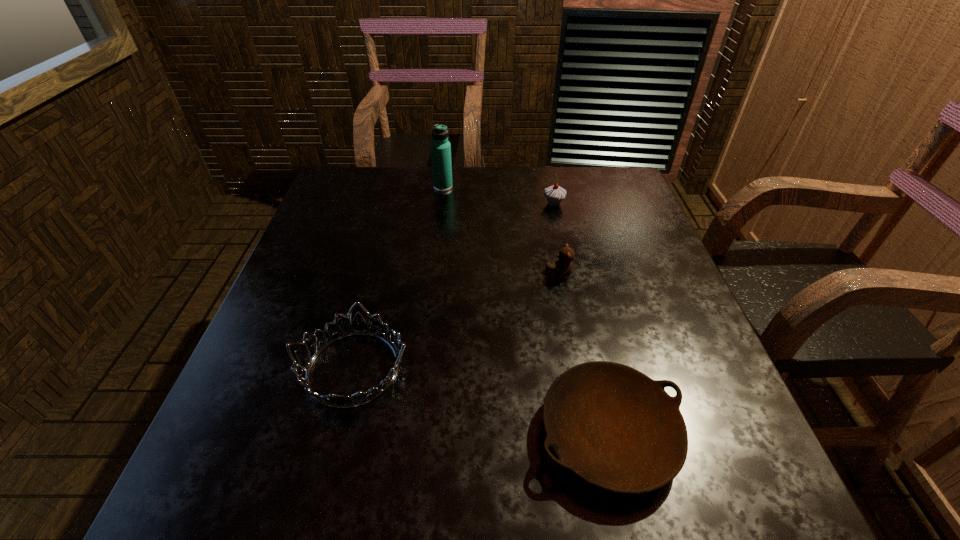
In order to click on free region located 0.340m on the face of the teddy bear in this screenshot , I will do `click(401, 275)`.

At what (x,y) coordinates should I click in order to perform the action: click on vacant space located on the face of the teddy bear. Please return your answer as a coordinate pair (x, y). The width and height of the screenshot is (960, 540). Looking at the image, I should click on (499, 275).

This screenshot has width=960, height=540. In order to click on free space located on the front-facing side of the tiara in this screenshot , I will do `click(525, 368)`.

You are a GUI agent. You are given a task and a screenshot of the screen. Output one action in this format:
    pyautogui.click(x=<x>, y=<y>)
    Task: Click on the vacant space located on the back of the shortest object
    This screenshot has height=540, width=960.
    Given the screenshot: What is the action you would take?
    pyautogui.click(x=566, y=248)

Find the location of a particular element. thermos bottle that is at the far edge is located at coordinates (440, 147).

This screenshot has height=540, width=960. What are the coordinates of `cupcake that is positioned at the far edge` in the screenshot? It's located at (554, 194).

In order to click on object at the near edge in this screenshot , I will do `click(612, 426)`.

At what (x,y) coordinates should I click in order to perform the action: click on object that is at the left edge. Please return your answer as a coordinate pair (x, y). The width and height of the screenshot is (960, 540). Looking at the image, I should click on (359, 326).

Image resolution: width=960 pixels, height=540 pixels. What are the coordinates of `object that is positioned at the right edge` in the screenshot? It's located at (612, 426).

The image size is (960, 540). Find the location of `object positioned at the near right corner`. object positioned at the near right corner is located at coordinates (612, 426).